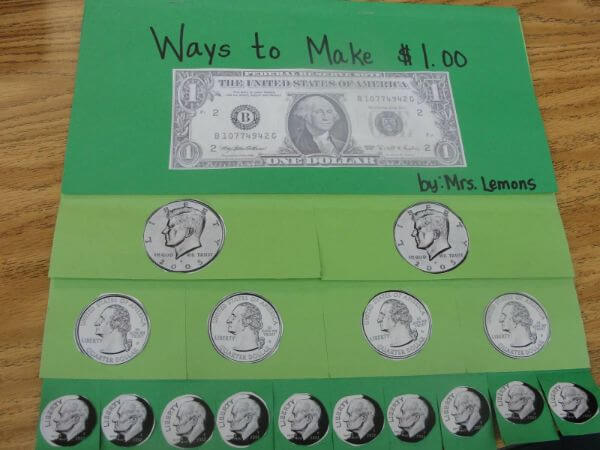
Identify the location of table. (x=33, y=211).